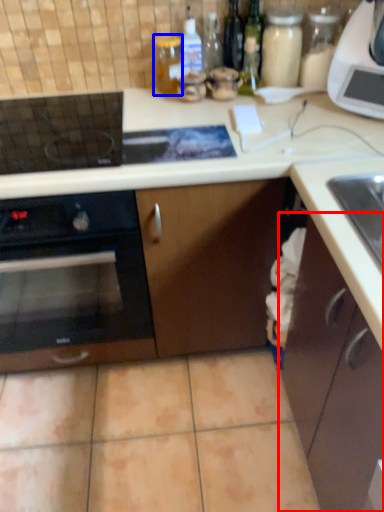
Question: Among these objects, which one is farthest to the camera, cabinetry (highlighted by a red box) or bottle (highlighted by a blue box)?

Choices:
 (A) cabinetry
 (B) bottle

Answer: (B)